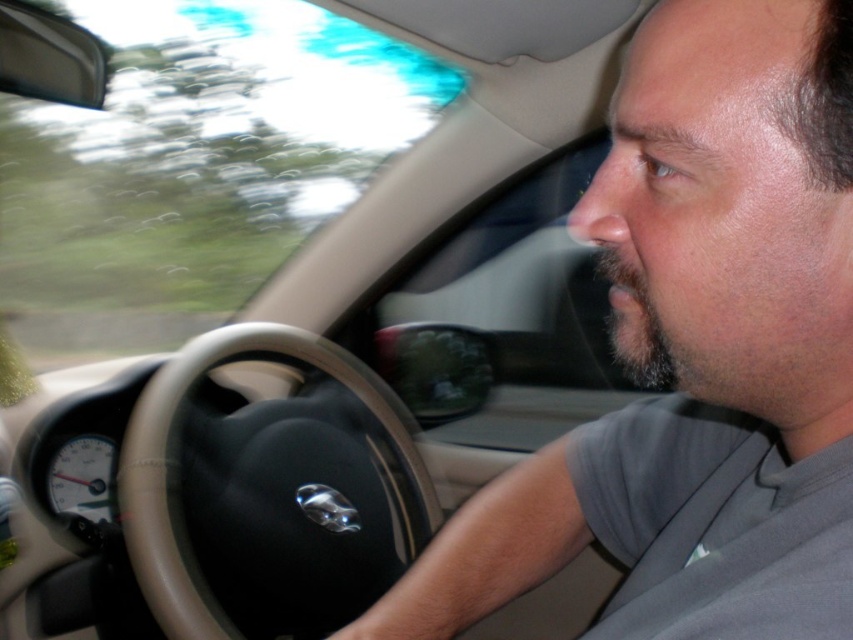
Is gray fabric shirt at center wider than black leather steering wheel at center?

In fact, gray fabric shirt at center might be narrower than black leather steering wheel at center.

Is gray fabric shirt at center shorter than black leather steering wheel at center?

In fact, gray fabric shirt at center may be taller than black leather steering wheel at center.

At what (x,y) coordinates should I click in order to perform the action: click on gray fabric shirt at center. Please return your answer as a coordinate pair (x, y). Looking at the image, I should click on (692, 337).